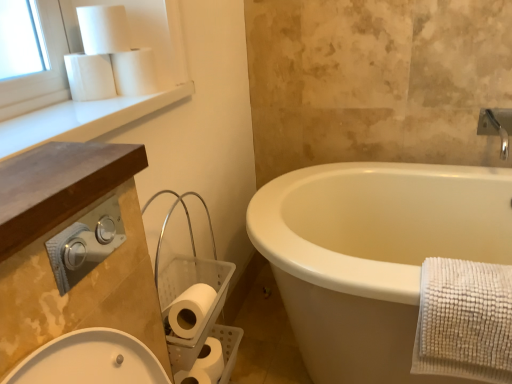
Question: Should I look upward or downward to see white matte toilet paper at lower left, the 4th toilet paper from the top?

Choices:
 (A) down
 (B) up

Answer: (A)

Question: Is brown wood countertop at upper left to the right of white matte toilet paper at upper left, arranged as the 1th toilet paper when viewed from the top, from the viewer's perspective?

Choices:
 (A) no
 (B) yes

Answer: (B)

Question: Is brown wood countertop at upper left looking in the opposite direction of white matte toilet paper at upper left, acting as the 5th toilet paper starting from the bottom?

Choices:
 (A) no
 (B) yes

Answer: (A)

Question: From a real-world perspective, is brown wood countertop at upper left on top of white matte toilet paper at upper left, arranged as the 1th toilet paper when viewed from the top?

Choices:
 (A) yes
 (B) no

Answer: (B)

Question: Does brown wood countertop at upper left have a lesser height compared to white matte toilet paper at upper left, acting as the 5th toilet paper starting from the bottom?

Choices:
 (A) no
 (B) yes

Answer: (B)

Question: Considering the relative sizes of brown wood countertop at upper left and white matte toilet paper at upper left, arranged as the 1th toilet paper when viewed from the top, in the image provided, is brown wood countertop at upper left taller than white matte toilet paper at upper left, arranged as the 1th toilet paper when viewed from the top,?

Choices:
 (A) yes
 (B) no

Answer: (B)

Question: From the image's perspective, is brown wood countertop at upper left over white matte toilet paper at upper left, acting as the 5th toilet paper starting from the bottom?

Choices:
 (A) no
 (B) yes

Answer: (A)

Question: From a real-world perspective, is brown wood countertop at upper left on top of white matte toilet paper at upper left, which is the 3th toilet paper in bottom-to-top order?

Choices:
 (A) yes
 (B) no

Answer: (B)

Question: Is the depth of brown wood countertop at upper left less than that of white matte toilet paper at upper left, acting as the third toilet paper starting from the top?

Choices:
 (A) yes
 (B) no

Answer: (A)

Question: Does brown wood countertop at upper left have a larger size compared to white matte toilet paper at upper left, acting as the third toilet paper starting from the top?

Choices:
 (A) yes
 (B) no

Answer: (A)

Question: Can you confirm if brown wood countertop at upper left is smaller than white matte toilet paper at upper left, which is the 3th toilet paper in bottom-to-top order?

Choices:
 (A) yes
 (B) no

Answer: (B)

Question: From the image's perspective, does brown wood countertop at upper left appear lower than white matte toilet paper at upper left, which is the 3th toilet paper in bottom-to-top order?

Choices:
 (A) yes
 (B) no

Answer: (A)

Question: Does brown wood countertop at upper left turn towards white matte toilet paper at upper left, which is the 3th toilet paper in bottom-to-top order?

Choices:
 (A) no
 (B) yes

Answer: (A)

Question: Does white matte toilet paper at lower center, the first toilet paper ordered from the bottom, have a lesser width compared to white matte toilet paper at upper left, acting as the third toilet paper starting from the top?

Choices:
 (A) no
 (B) yes

Answer: (A)